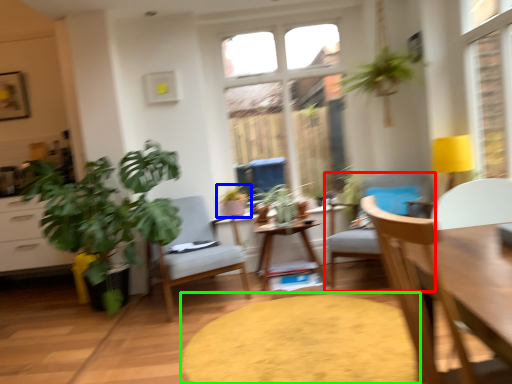
Question: Estimate the real-world distances between objects in this image. Which object is farther from chair (highlighted by a red box), houseplant (highlighted by a blue box) or round table (highlighted by a green box)?

Choices:
 (A) houseplant
 (B) round table

Answer: (A)